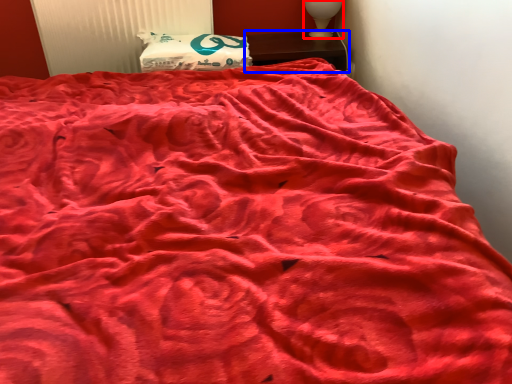
Question: Which object is closer to the camera taking this photo, table lamp (highlighted by a red box) or furniture (highlighted by a blue box)?

Choices:
 (A) table lamp
 (B) furniture

Answer: (B)